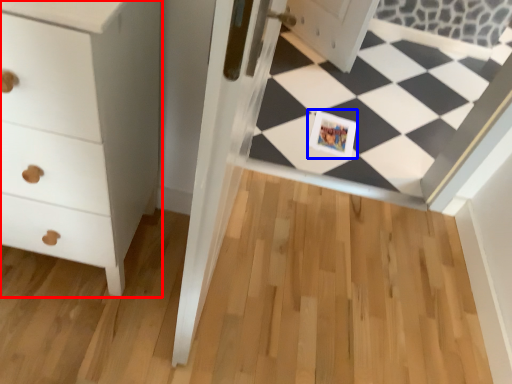
Question: Among these objects, which one is farthest to the camera, chest of drawers (highlighted by a red box) or postcard (highlighted by a blue box)?

Choices:
 (A) chest of drawers
 (B) postcard

Answer: (B)